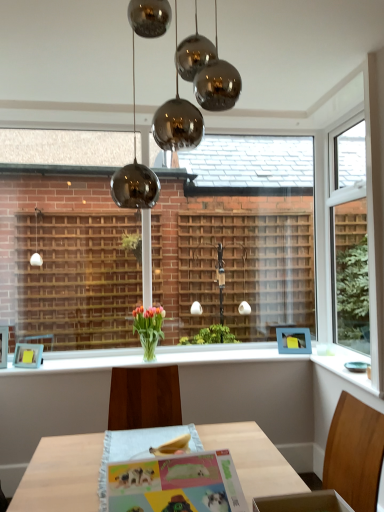
Question: Is the position of polished chrome chandelier at upper center less distant than that of blue matte picture frame at upper right, placed as the first picture frame when sorted from right to left?

Choices:
 (A) yes
 (B) no

Answer: (A)

Question: Is polished chrome chandelier at upper center shorter than blue matte picture frame at upper right, the second picture frame when ordered from left to right?

Choices:
 (A) yes
 (B) no

Answer: (B)

Question: Is polished chrome chandelier at upper center far from blue matte picture frame at upper right, which is counted as the second picture frame, starting from the front?

Choices:
 (A) yes
 (B) no

Answer: (A)

Question: Considering the relative sizes of polished chrome chandelier at upper center and blue matte picture frame at upper right, which is counted as the second picture frame, starting from the front, in the image provided, is polished chrome chandelier at upper center wider than blue matte picture frame at upper right, which is counted as the second picture frame, starting from the front,?

Choices:
 (A) no
 (B) yes

Answer: (B)

Question: From the image's perspective, would you say polished chrome chandelier at upper center is positioned over blue matte picture frame at upper right, which is counted as the second picture frame, starting from the front?

Choices:
 (A) yes
 (B) no

Answer: (A)

Question: Is polished chrome chandelier at upper center aimed at blue matte picture frame at upper right, placed as the first picture frame when sorted from right to left?

Choices:
 (A) yes
 (B) no

Answer: (B)

Question: Is polished chrome chandelier at upper center bigger than matte glass vase at center?

Choices:
 (A) yes
 (B) no

Answer: (B)

Question: From a real-world perspective, is polished chrome chandelier at upper center on matte glass vase at center?

Choices:
 (A) yes
 (B) no

Answer: (A)

Question: From the image's perspective, is polished chrome chandelier at upper center located beneath matte glass vase at center?

Choices:
 (A) yes
 (B) no

Answer: (B)

Question: Could you tell me if polished chrome chandelier at upper center is turned towards matte glass vase at center?

Choices:
 (A) yes
 (B) no

Answer: (B)

Question: Is polished chrome chandelier at upper center positioned in front of matte glass vase at center?

Choices:
 (A) no
 (B) yes

Answer: (B)

Question: Does polished chrome chandelier at upper center appear on the left side of matte glass vase at center?

Choices:
 (A) yes
 (B) no

Answer: (B)

Question: Is white glossy plate at lower right, the 1th window sill viewed from the right, surrounded by matte paper postcard at center?

Choices:
 (A) no
 (B) yes

Answer: (A)